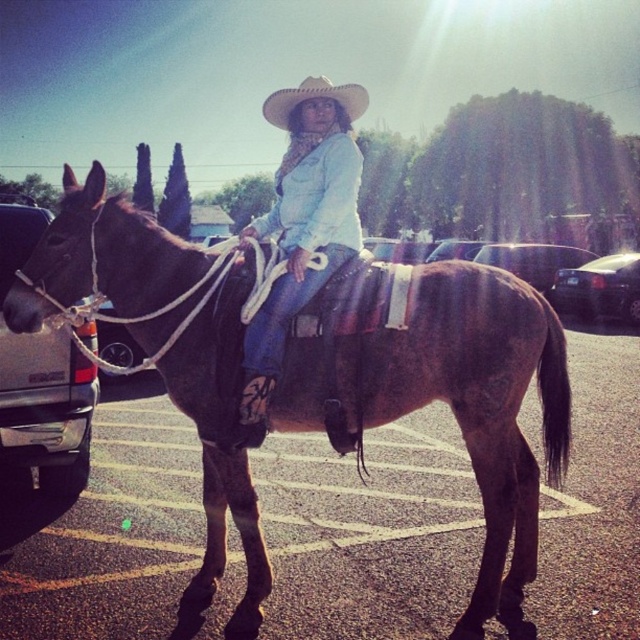
You are a delivery person who needs to back out of the parking lot. You see the brushed metal truck at left and the black glossy sedan at right. Which vehicle should you avoid hitting while backing out?

You should avoid hitting the brushed metal truck at left because it is in front of the black glossy sedan at right, meaning it is closer to your path when backing out.

You are a delivery person who needs to place a package on the ground between the brushed metal truck at left and the light beige straw cowboy hat at center. The package requires a space of 2.5 meters. Can you fit it there?

The distance between the brushed metal truck at left and the light beige straw cowboy hat at center is 3.05 meters, so yes, the package requiring 2.5 meters of space can fit between them.